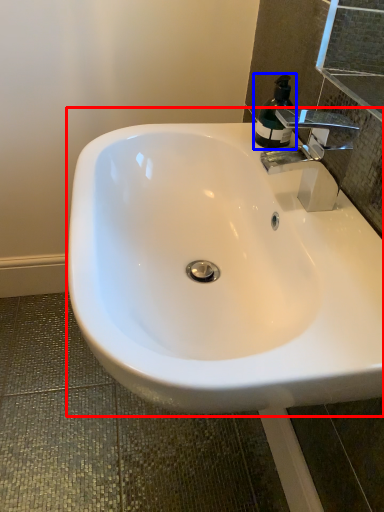
Question: Which object appears farthest to the camera in this image, sink (highlighted by a red box) or soap dispenser (highlighted by a blue box)?

Choices:
 (A) sink
 (B) soap dispenser

Answer: (B)